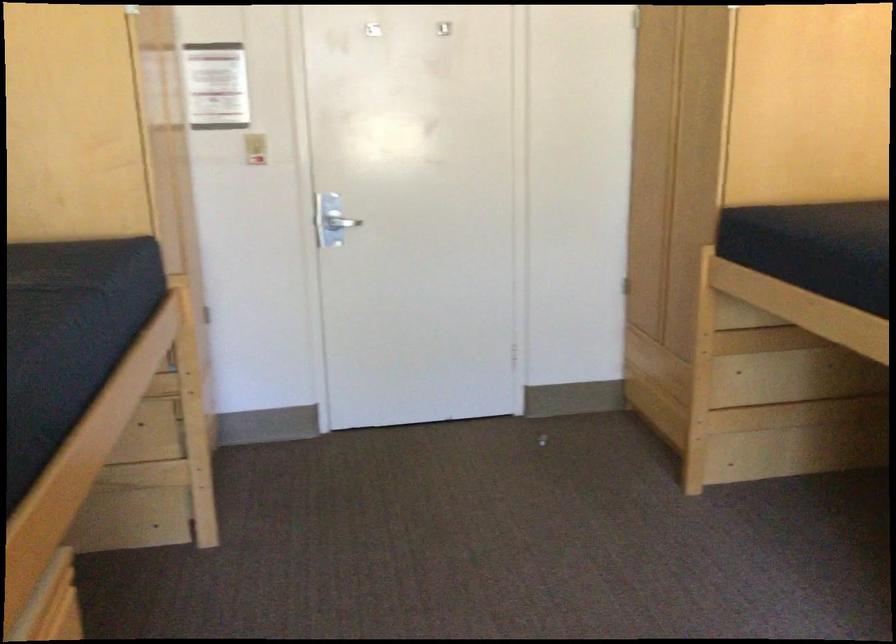
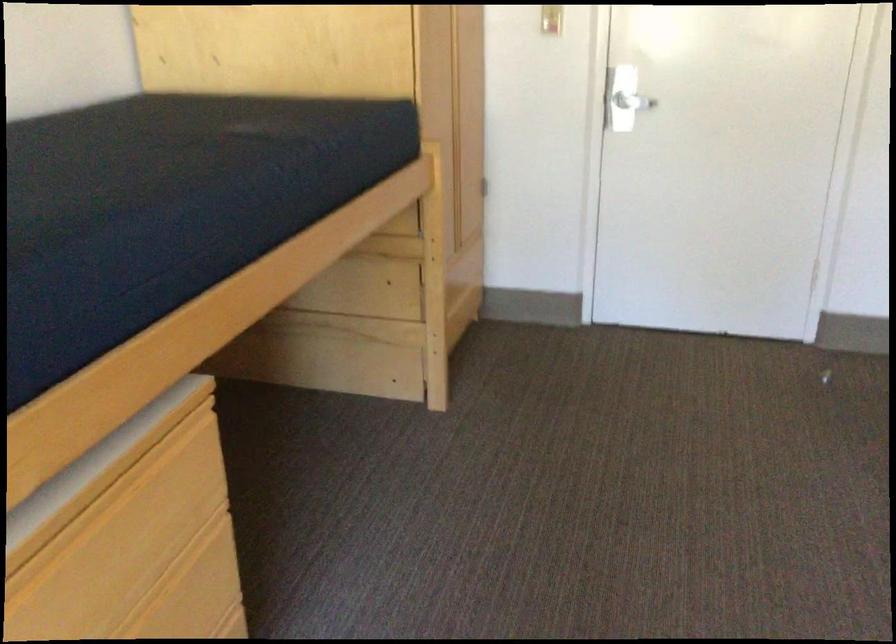
Question: The first image is from the beginning of the video and the second image is from the end. How did the camera likely rotate when shooting the video?

Choices:
 (A) Left
 (B) Right
 (C) Up
 (D) Down

Answer: (A)